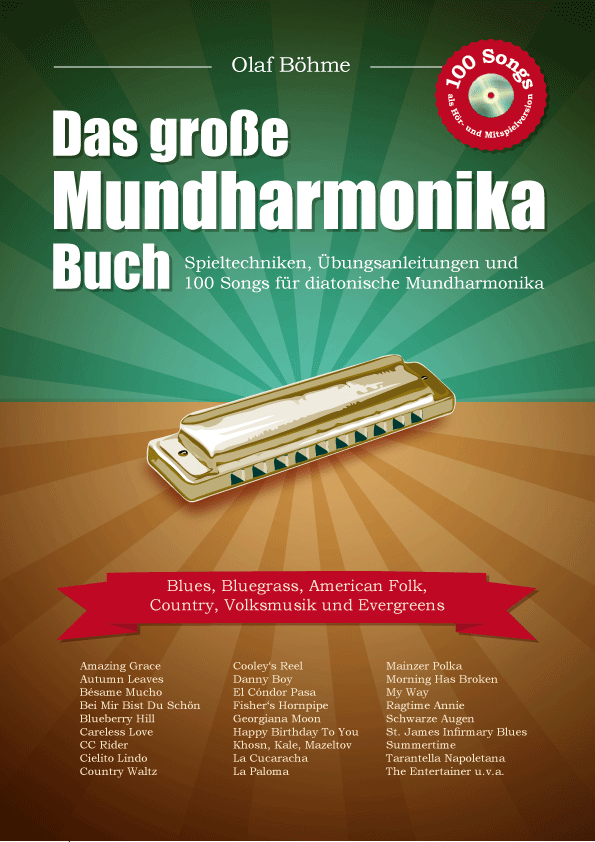
Locate an element on the screen. Image resolution: width=595 pixels, height=842 pixels. cd is located at coordinates (504, 105).